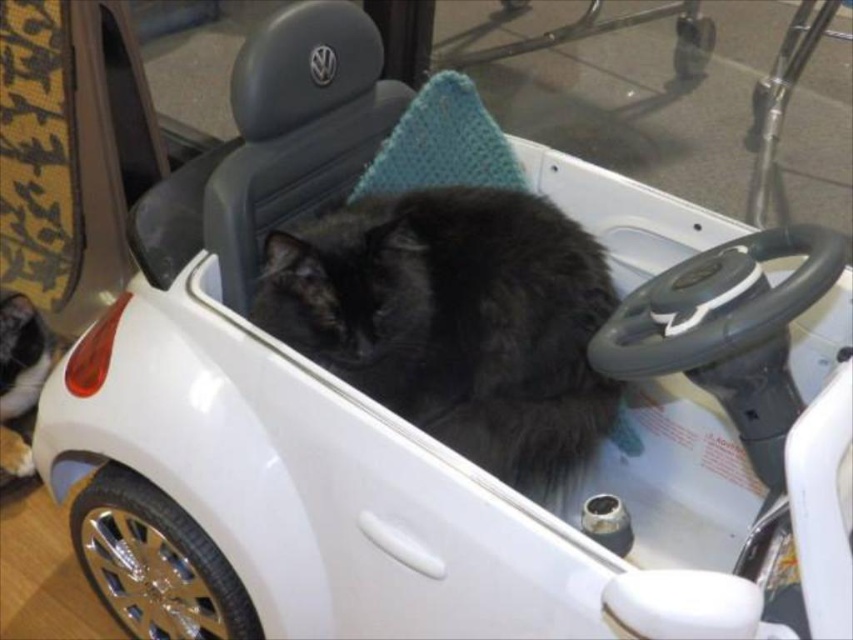
Who is positioned more to the left, black fluffy cat at center or black fur cat at lower left?

black fur cat at lower left is more to the left.

Is black fluffy cat at center thinner than black fur cat at lower left?

No, black fluffy cat at center is not thinner than black fur cat at lower left.

Between point (573, 346) and point (24, 307), which one is positioned behind?

The point (24, 307) is behind.

Locate an element on the screen. The height and width of the screenshot is (640, 853). black fluffy cat at center is located at coordinates (456, 321).